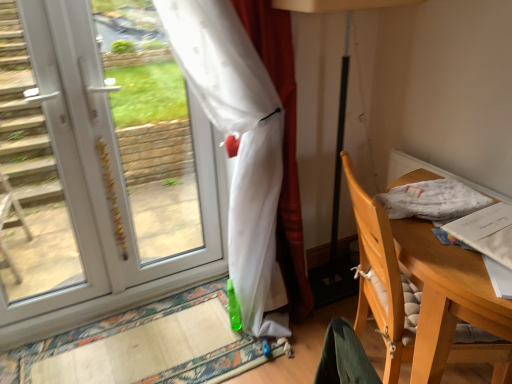
The width and height of the screenshot is (512, 384). Describe the element at coordinates (30, 180) in the screenshot. I see `white plastic door at left` at that location.

What do you see at coordinates (143, 346) in the screenshot? I see `carpeted mat at lower left` at bounding box center [143, 346].

The height and width of the screenshot is (384, 512). What do you see at coordinates (341, 80) in the screenshot?
I see `black plastic table lamp at center` at bounding box center [341, 80].

At what (x,y) coordinates should I click in order to perform the action: click on wooden chair at right. Please return your answer as a coordinate pair (x, y). Looking at the image, I should click on (400, 271).

What do you see at coordinates (432, 200) in the screenshot? I see `white fabric at right` at bounding box center [432, 200].

This screenshot has width=512, height=384. I want to click on white plastic door at left, so click(30, 180).

From the image's perspective, does white fabric at right appear lower than black plastic table lamp at center?

Yes, from the image's perspective, white fabric at right is beneath black plastic table lamp at center.

Would you say white fabric at right is outside black plastic table lamp at center?

→ Yes, white fabric at right is not within black plastic table lamp at center.

Which of these two, white fabric at right or black plastic table lamp at center, stands shorter?

white fabric at right.

Is white fabric at right in front of or behind black plastic table lamp at center in the image?

white fabric at right is in front of black plastic table lamp at center.

Which object is closer to the camera taking this photo, wooden chair at right or translucent white curtain at left?

Positioned in front is wooden chair at right.

Is translucent white curtain at left inside wooden chair at right?

No, translucent white curtain at left is not inside wooden chair at right.

Who is bigger, wooden chair at right or translucent white curtain at left?

translucent white curtain at left is bigger.

Does wooden chair at right turn towards translucent white curtain at left?

No, wooden chair at right is not aimed at translucent white curtain at left.

From a real-world perspective, is carpeted mat at lower left below white plastic door at left?

Correct, in the physical world, carpeted mat at lower left is lower than white plastic door at left.

Which of these two, carpeted mat at lower left or white plastic door at left, is thinner?

white plastic door at left.

Is carpeted mat at lower left next to white plastic door at left?

No, carpeted mat at lower left is not touching white plastic door at left.

Is white plastic door at left touching black plastic table lamp at center?

No, white plastic door at left is not touching black plastic table lamp at center.

Does white plastic door at left have a greater width compared to black plastic table lamp at center?

No.

Is white plastic door at left aimed at black plastic table lamp at center?

No, white plastic door at left is not aimed at black plastic table lamp at center.

Is white plastic door at left taller or shorter than black plastic table lamp at center?

Considering their sizes, white plastic door at left has more height than black plastic table lamp at center.

Which is behind, point (369, 144) or point (438, 185)?

Positioned behind is point (369, 144).

Is white fabric at right located within black plastic table lamp at center?

No, white fabric at right is not a part of black plastic table lamp at center.

In order to click on cloth on the right side of black plastic table lamp at center in this screenshot , I will do `click(432, 200)`.

Consider the image. Is black plastic table lamp at center facing towards white fabric at right?

Yes, black plastic table lamp at center is aimed at white fabric at right.

Are translucent white curtain at left and carpeted mat at lower left located far from each other?

They are positioned close to each other.

Considering the points (259, 163) and (190, 308), which point is in front, point (259, 163) or point (190, 308)?

The point (259, 163) is closer.

Considering the relative sizes of translucent white curtain at left and carpeted mat at lower left in the image provided, is translucent white curtain at left wider than carpeted mat at lower left?

In fact, translucent white curtain at left might be narrower than carpeted mat at lower left.

In the scene shown: Is translucent white curtain at left positioned with its back to carpeted mat at lower left?

translucent white curtain at left is not turned away from carpeted mat at lower left.

From a real-world perspective, between white fabric at right and carpeted mat at lower left, who is vertically higher?

From a 3D spatial view, white fabric at right is above.

Is white fabric at right aimed at carpeted mat at lower left?

No, white fabric at right is not aimed at carpeted mat at lower left.

Based on their sizes in the image, would you say white fabric at right is bigger or smaller than carpeted mat at lower left?

Clearly, white fabric at right is smaller in size than carpeted mat at lower left.

Which is behind, white fabric at right or carpeted mat at lower left?

Positioned behind is carpeted mat at lower left.

Image resolution: width=512 pixels, height=384 pixels. I want to click on cloth that appears in front of the black plastic table lamp at center, so click(432, 200).

What are the coordinates of `chair below the translucent white curtain at left (from a real-world perspective)` in the screenshot? It's located at (400, 271).

Which object lies further to the anchor point carpeted mat at lower left, translucent white curtain at left or wooden chair at right?

The object further to carpeted mat at lower left is wooden chair at right.

Considering their positions, is white fabric at right positioned further to white plastic door at left than carpeted mat at lower left?

The object further to white plastic door at left is white fabric at right.

Consider the image. Looking at the image, which one is located closer to white fabric at right, white plastic door at left or black plastic table lamp at center?

Based on the image, black plastic table lamp at center appears to be nearer to white fabric at right.

Consider the image. Which object lies further to the anchor point white fabric at right, white plastic door at left or carpeted mat at lower left?

white plastic door at left lies further to white fabric at right than the other object.

Which object lies further to the anchor point carpeted mat at lower left, translucent white curtain at left or white fabric at right?

white fabric at right lies further to carpeted mat at lower left than the other object.

From the image, which object appears to be farther from white plastic door at left, translucent white curtain at left or wooden chair at right?

wooden chair at right is further to white plastic door at left.

Considering their positions, is white plastic door at left positioned further to black plastic table lamp at center than white fabric at right?

white plastic door at left is further to black plastic table lamp at center.

From the image, which object appears to be farther from translucent white curtain at left, white fabric at right or carpeted mat at lower left?

The object further to translucent white curtain at left is white fabric at right.

I want to click on curtain between white plastic door at left and black plastic table lamp at center from left to right, so pos(239,146).

At what (x,y) coordinates should I click in order to perform the action: click on door situated between white plastic door at left and translucent white curtain at left from left to right. Please return your answer as a coordinate pair (x, y). The width and height of the screenshot is (512, 384). Looking at the image, I should click on (97, 156).

Find the location of a particular element. The height and width of the screenshot is (384, 512). curtain situated between white plastic door at left and white fabric at right from left to right is located at coordinates (239, 146).

Locate an element on the screen. This screenshot has height=384, width=512. cloth located between white plastic door at left and wooden chair at right in the left-right direction is located at coordinates (432, 200).